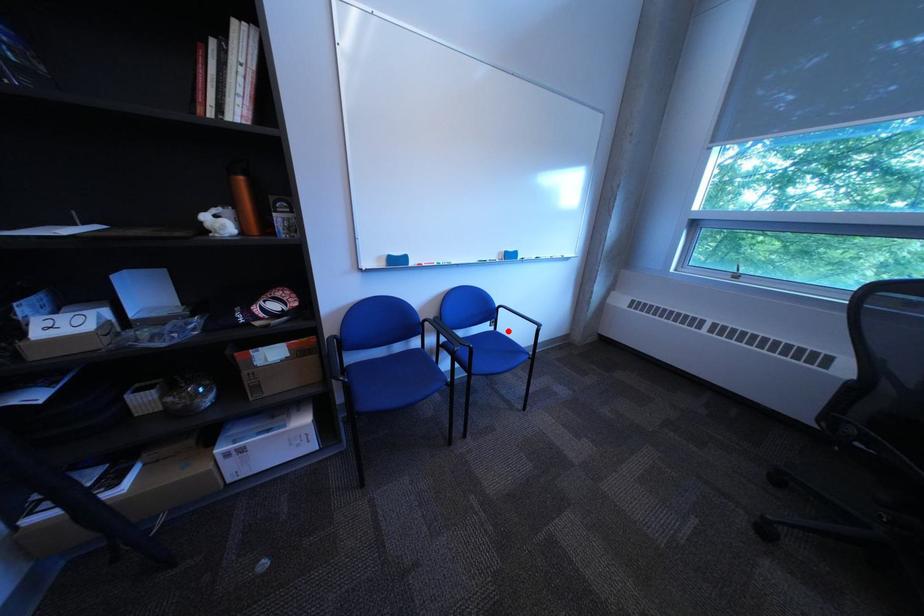
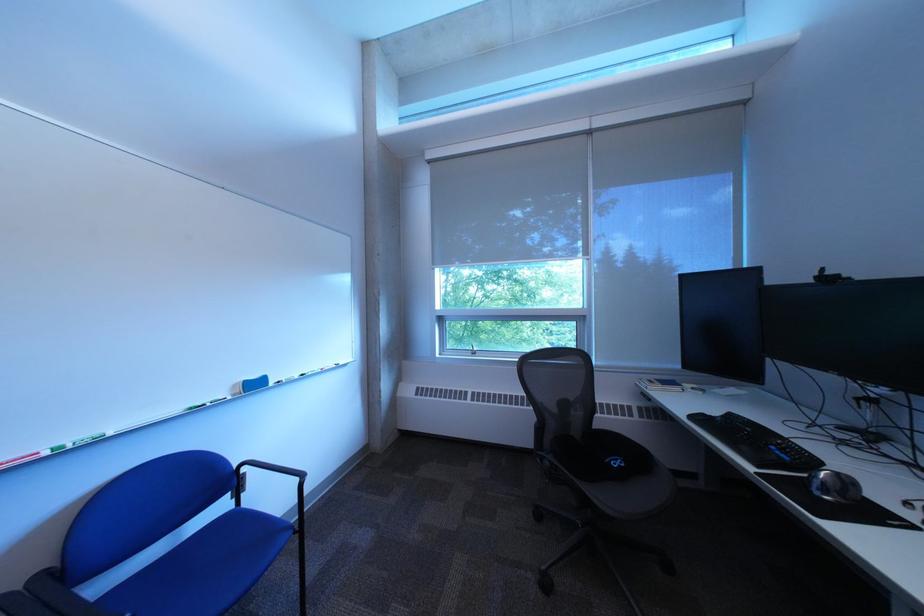
Locate, in the second image, the point that corresponds to the highlighted location in the first image.

(248, 508)